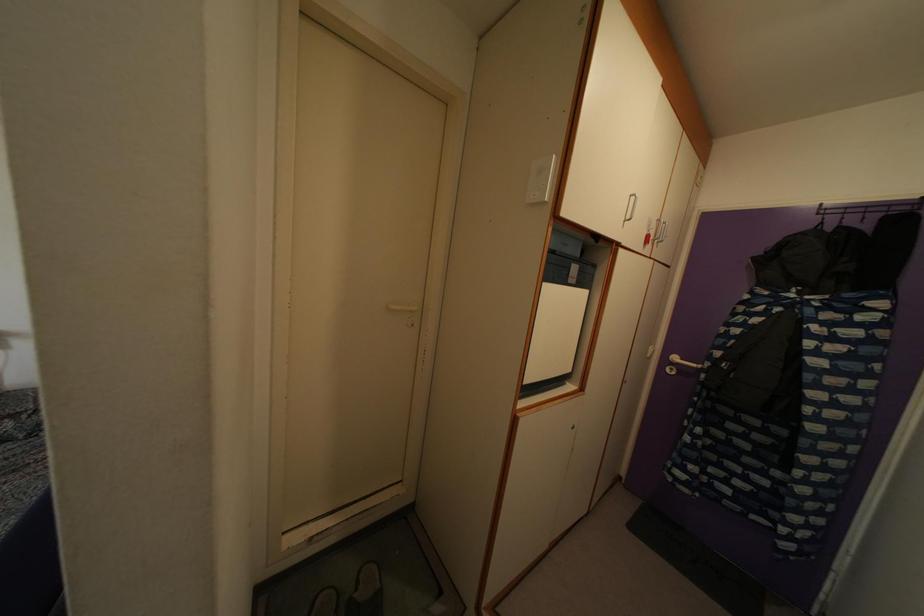
What are the coordinates of `white door handle` in the screenshot? It's located at (405, 304).